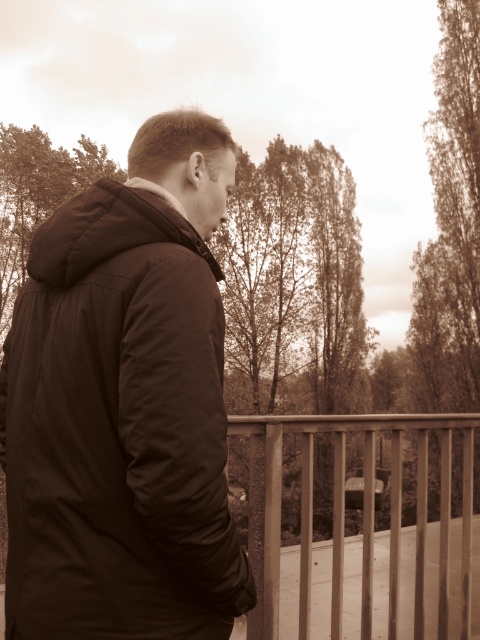
Question: Does matte black jacket at center lie behind metallic silver fence at lower right?

Choices:
 (A) no
 (B) yes

Answer: (A)

Question: Does matte black jacket at center have a larger size compared to metallic silver fence at lower right?

Choices:
 (A) no
 (B) yes

Answer: (A)

Question: Among these points, which one is farthest from the camera?

Choices:
 (A) (303, 522)
 (B) (29, 426)

Answer: (A)

Question: Among these points, which one is nearest to the camera?

Choices:
 (A) (205, 355)
 (B) (384, 420)

Answer: (A)

Question: Does matte black jacket at center appear under metallic silver fence at lower right?

Choices:
 (A) no
 (B) yes

Answer: (A)